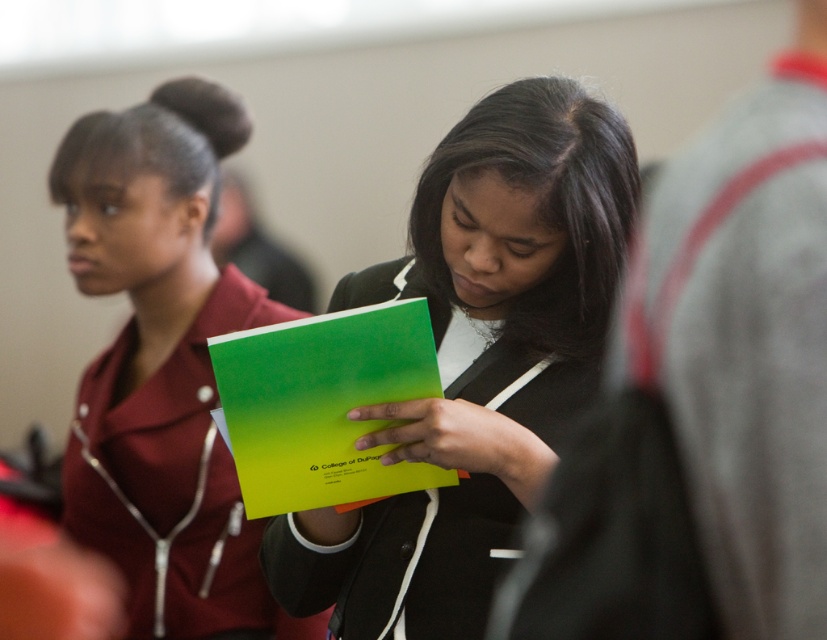
Question: Does maroon fabric shirt at upper left have a greater width compared to green matte folder at center?

Choices:
 (A) yes
 (B) no

Answer: (A)

Question: Is matte green folder at center in front of maroon fabric shirt at upper left?

Choices:
 (A) no
 (B) yes

Answer: (B)

Question: Which object appears closest to the camera in this image?

Choices:
 (A) matte green folder at center
 (B) green matte folder at center

Answer: (B)

Question: Is matte green folder at center smaller than maroon fabric shirt at upper left?

Choices:
 (A) no
 (B) yes

Answer: (B)

Question: Among these points, which one is nearest to the camera?

Choices:
 (A) (165, 189)
 (B) (232, 387)

Answer: (B)

Question: Which of these objects is positioned closest to the green matte folder at center?

Choices:
 (A) maroon fabric shirt at upper left
 (B) matte green folder at center

Answer: (B)